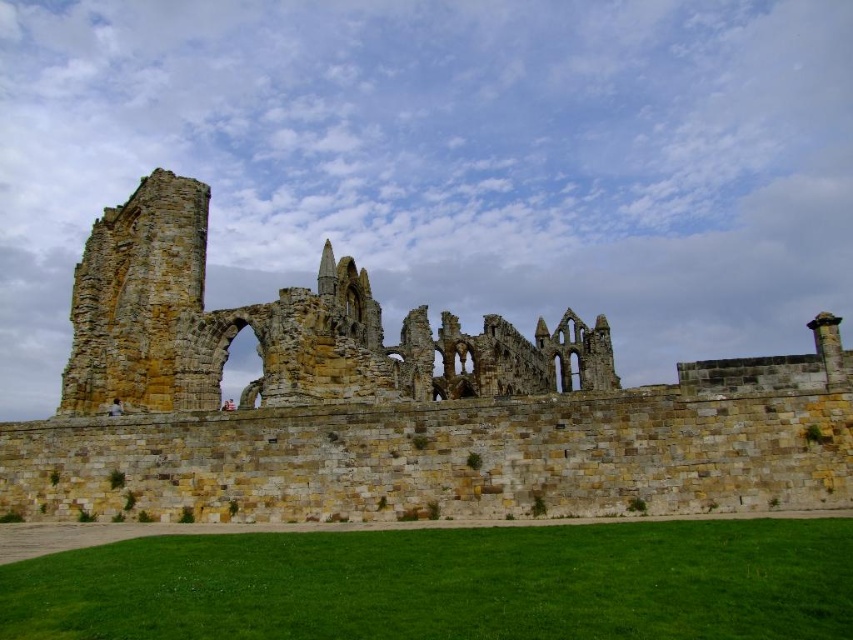
Question: Can you confirm if brown stone ruins at center is positioned to the left of stone ruins at center?

Choices:
 (A) no
 (B) yes

Answer: (B)

Question: From the image, what is the correct spatial relationship of brown stone ruins at center in relation to stone ruins at center?

Choices:
 (A) above
 (B) below

Answer: (A)

Question: Which point appears farthest from the camera in this image?

Choices:
 (A) (325, 477)
 (B) (599, 316)

Answer: (B)

Question: Is brown stone ruins at center smaller than stone ruins at center?

Choices:
 (A) no
 (B) yes

Answer: (A)

Question: Which point is farther from the camera taking this photo?

Choices:
 (A) [x=444, y=385]
 (B) [x=740, y=412]

Answer: (A)